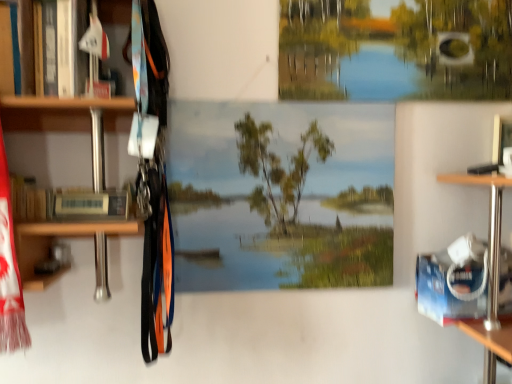
Identify the location of hardcover book at left. (67, 203).

This screenshot has height=384, width=512. I want to click on green matte tree at upper center, so pyautogui.click(x=395, y=50).

Describe the element at coordinates (284, 194) in the screenshot. I see `smooth canvas mural at center` at that location.

You are a GUI agent. You are given a task and a screenshot of the screen. Output one action in this format:
    pyautogui.click(x=<x>, y=<y>)
    Task: Click on the hardcover book at left
    Image resolution: width=512 pixels, height=384 pixels.
    Given the screenshot: What is the action you would take?
    (67, 203)

Is smooth canvas mural at center not within green matte tree at upper center?

Absolutely, smooth canvas mural at center is external to green matte tree at upper center.

Relative to green matte tree at upper center, is smooth canvas mural at center in front or behind?

Visually, smooth canvas mural at center is located in front of green matte tree at upper center.

How different are the orientations of smooth canvas mural at center and green matte tree at upper center in degrees?

0.0666 degrees separate the facing orientations of smooth canvas mural at center and green matte tree at upper center.

From the image's perspective, which is below, smooth canvas mural at center or green matte tree at upper center?

smooth canvas mural at center, from the image's perspective.

From a real-world perspective, is hardcover book at left on top of smooth canvas mural at center?

Indeed, from a real-world perspective, hardcover book at left stands above smooth canvas mural at center.

Between hardcover book at left and smooth canvas mural at center, which one has more height?

smooth canvas mural at center is taller.

Is point (111, 213) closer to viewer compared to point (365, 161)?

Yes, point (111, 213) is closer to viewer.

Considering the sizes of objects hardcover book at left and smooth canvas mural at center in the image provided, who is thinner, hardcover book at left or smooth canvas mural at center?

With smaller width is smooth canvas mural at center.

In terms of width, does smooth canvas mural at center look wider or thinner when compared to hardcover book at left?

Considering their sizes, smooth canvas mural at center looks slimmer than hardcover book at left.

Which object is positioned more to the right, smooth canvas mural at center or hardcover book at left?

From the viewer's perspective, smooth canvas mural at center appears more on the right side.

From the image's perspective, is smooth canvas mural at center over hardcover book at left?

No, from the image's perspective, smooth canvas mural at center is not on top of hardcover book at left.

Considering the relative sizes of green matte tree at upper center and hardcover book at left in the image provided, is green matte tree at upper center shorter than hardcover book at left?

In fact, green matte tree at upper center may be taller than hardcover book at left.

Which object is further away from the camera, green matte tree at upper center or hardcover book at left?

green matte tree at upper center is behind.

Between green matte tree at upper center and hardcover book at left, which one has smaller size?

With smaller size is hardcover book at left.

How many degrees apart are the facing directions of green matte tree at upper center and hardcover book at left?

1.09 degrees separate the facing orientations of green matte tree at upper center and hardcover book at left.

Between green matte tree at upper center and smooth canvas mural at center, which one has smaller width?

smooth canvas mural at center.

Is green matte tree at upper center inside the boundaries of smooth canvas mural at center, or outside?

green matte tree at upper center is spatially situated outside smooth canvas mural at center.

From the image's perspective, does green matte tree at upper center appear lower than smooth canvas mural at center?

No.

Who is more distant, green matte tree at upper center or smooth canvas mural at center?

green matte tree at upper center is behind.

From the image's perspective, is hardcover book at left positioned above or below green matte tree at upper center?

From the image's perspective, hardcover book at left appears below green matte tree at upper center.

Measure the distance from hardcover book at left to green matte tree at upper center.

The distance of hardcover book at left from green matte tree at upper center is 72.91 centimeters.

Is hardcover book at left outside of green matte tree at upper center?

Yes, hardcover book at left is outside of green matte tree at upper center.

Is hardcover book at left not near green matte tree at upper center?

hardcover book at left is actually quite close to green matte tree at upper center.

The height and width of the screenshot is (384, 512). What are the coordinates of `tree located above the smooth canvas mural at center (from the image's perspective)` in the screenshot? It's located at (395, 50).

In order to click on mural that is under the hardcover book at left (from a real-world perspective) in this screenshot , I will do `click(284, 194)`.

Based on their spatial positions, is hardcover book at left or smooth canvas mural at center further from green matte tree at upper center?

Among the two, hardcover book at left is located further to green matte tree at upper center.

Estimate the real-world distances between objects in this image. Which object is closer to smooth canvas mural at center, green matte tree at upper center or hardcover book at left?

Based on the image, green matte tree at upper center appears to be nearer to smooth canvas mural at center.

Looking at the image, which one is located closer to hardcover book at left, green matte tree at upper center or smooth canvas mural at center?

Based on the image, smooth canvas mural at center appears to be nearer to hardcover book at left.

When comparing their distances from smooth canvas mural at center, does hardcover book at left or green matte tree at upper center seem further?

hardcover book at left lies further to smooth canvas mural at center than the other object.

From the image, which object appears to be nearer to hardcover book at left, smooth canvas mural at center or green matte tree at upper center?

smooth canvas mural at center lies closer to hardcover book at left than the other object.

From the image, which object appears to be nearer to green matte tree at upper center, smooth canvas mural at center or hardcover book at left?

smooth canvas mural at center.

Find the location of a particular element. mural situated between hardcover book at left and green matte tree at upper center from left to right is located at coordinates (284, 194).